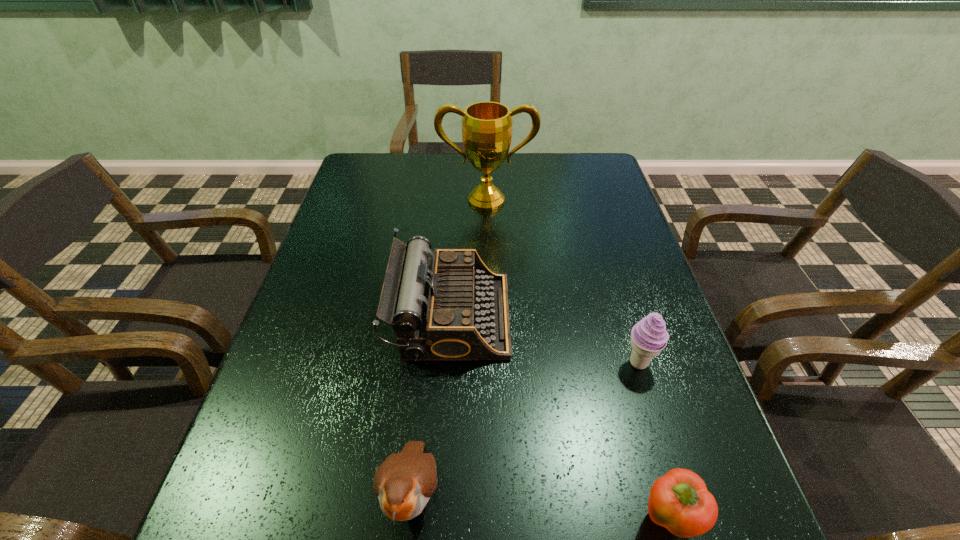
In the image, there is a desktop. What are the coordinates of `vacant space at the left edge` in the screenshot? It's located at (310, 299).

Where is `vacant area at the far left corner of the desktop`? The width and height of the screenshot is (960, 540). vacant area at the far left corner of the desktop is located at coordinates (375, 182).

At what (x,y) coordinates should I click in order to perform the action: click on vacant point at the far right corner. Please return your answer as a coordinate pair (x, y). Looking at the image, I should click on (604, 185).

What are the coordinates of `empty space that is in between the icecream and the typewriter` in the screenshot? It's located at (544, 339).

The height and width of the screenshot is (540, 960). In order to click on the second closest object relative to the bird in this screenshot , I will do `click(679, 501)`.

Select which object is the closest to the icecream. Please provide its 2D coordinates. Your answer should be formatted as a tuple, i.e. [(x, y)], where the tuple contains the x and y coordinates of a point satisfying the conditions above.

[(679, 501)]

The image size is (960, 540). In order to click on vacant space that satisfies the following two spatial constraints: 1. on the keyboard of the icecream; 2. on the right side of the typewriter in this screenshot , I will do `click(447, 362)`.

You are a GUI agent. You are given a task and a screenshot of the screen. Output one action in this format:
    pyautogui.click(x=<x>, y=<y>)
    Task: Click on the free space that satisfies the following two spatial constraints: 1. on the front-facing side of the award; 2. on the left side of the icecream
    This screenshot has width=960, height=540.
    Given the screenshot: What is the action you would take?
    pyautogui.click(x=490, y=362)

Locate an element on the screen. Image resolution: width=960 pixels, height=540 pixels. vacant area in the image that satisfies the following two spatial constraints: 1. on the keyboard of the icecream; 2. on the left side of the typewriter is located at coordinates (447, 362).